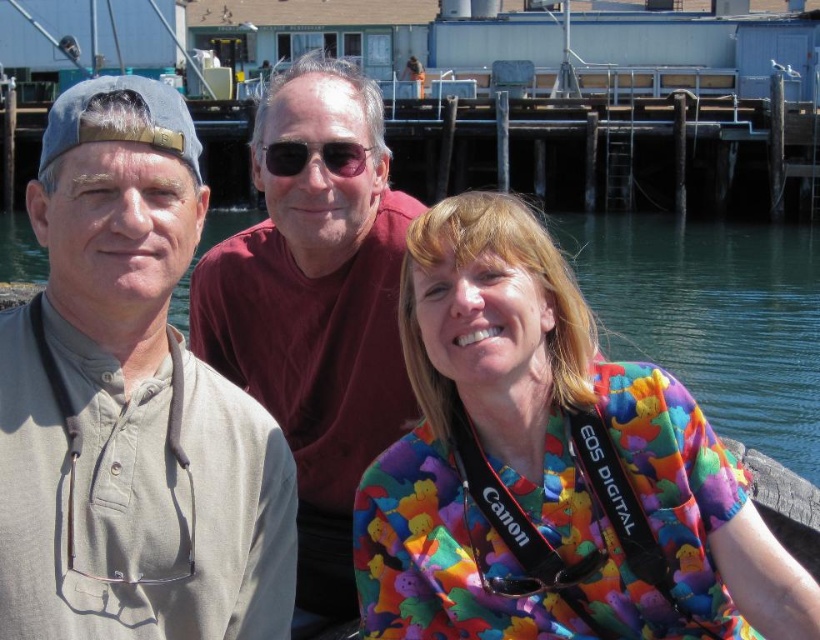
Question: Which object appears farthest from the camera in this image?

Choices:
 (A) black reflective sunglasses at center
 (B) maroon cotton shirt at center
 (C) khaki cotton shirt at left
 (D) clear water at center

Answer: (D)

Question: Can you confirm if multicolored fabric shirt at center is positioned below maroon cotton shirt at center?

Choices:
 (A) no
 (B) yes

Answer: (B)

Question: Considering the relative positions of clear water at center and black reflective sunglasses at center in the image provided, where is clear water at center located with respect to black reflective sunglasses at center?

Choices:
 (A) left
 (B) right

Answer: (A)

Question: Is multicolored fabric shirt at center thinner than khaki cotton shirt at left?

Choices:
 (A) no
 (B) yes

Answer: (A)

Question: Which object appears closest to the camera in this image?

Choices:
 (A) khaki cotton shirt at left
 (B) multicolored fabric shirt at center

Answer: (A)

Question: Which object is closer to the camera taking this photo?

Choices:
 (A) multicolored fabric shirt at center
 (B) clear water at center
 (C) black reflective sunglasses at center
 (D) khaki cotton shirt at left

Answer: (D)